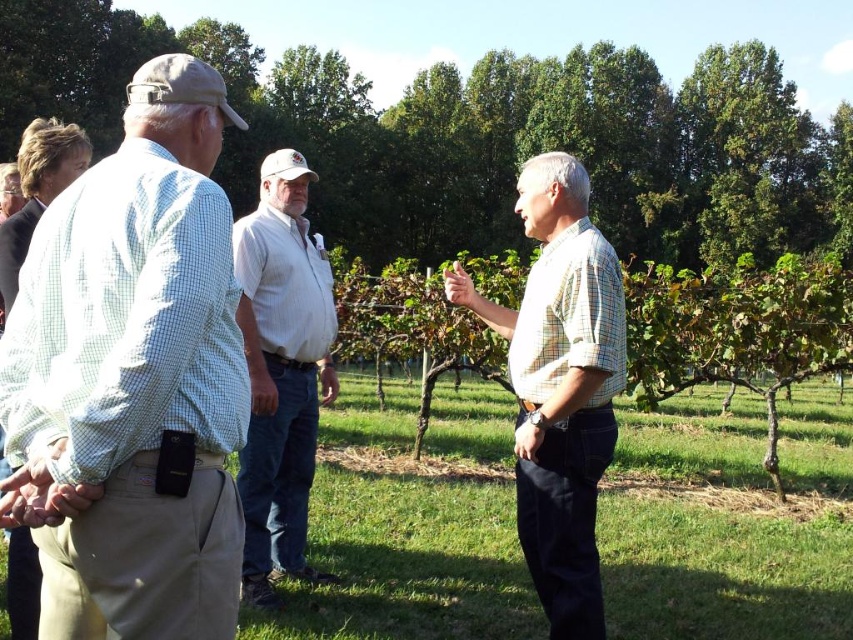
In the scene shown: You are standing at the origin point of the image coordinate system. You want to find the light green checkered shirt at left. In which direction should you look?

The light green checkered shirt at left is located at coordinates point 0.591 on the x axis and 0.156 on the y axis. Since the origin is at the bottom left corner of the image, you should look to the right and slightly upwards to find the light green checkered shirt at left.

You are a photographer trying to capture a photo of the group. You want to ensure both the light green checkered shirt at left and the white striped shirt at center are clearly visible in the frame. Based on their positions, which shirt should you focus on first to ensure both are in focus?

The light green checkered shirt at left is to the right of the white striped shirt at center. To ensure both are in focus, you should focus on the shirt that is closer to the center of the frame first, which is the white striped shirt at center, as it is centrally positioned and the other shirt is slightly offset to its right.